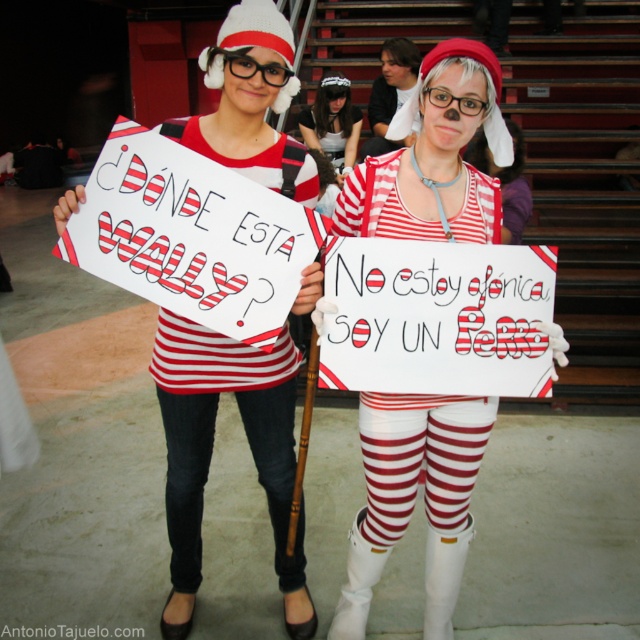
You are a costume designer trying to replicate the iconic Wally costume. You have two items in front of you, the white matte striped shirt at center and the white fabric headband at center. Based on their positions in the image, which item should you place first when assembling the costume?

The white matte striped shirt at center should be placed first because it is in front of the white fabric headband at center, indicating it is worn over the headband.

You are a detective searching for Wally in the image. You have a map that marks a specific point at coordinates [413,497]. What object is located at this point?

The white matte striped shirt at center is located at point [413,497].

You are standing in front of the image and want to determine which of the two points, point (378, 205) or point (320, 84), is closer to you. Based on the scene, which point is nearer?

Point (378, 205) is closer to the viewer than point (320, 84).